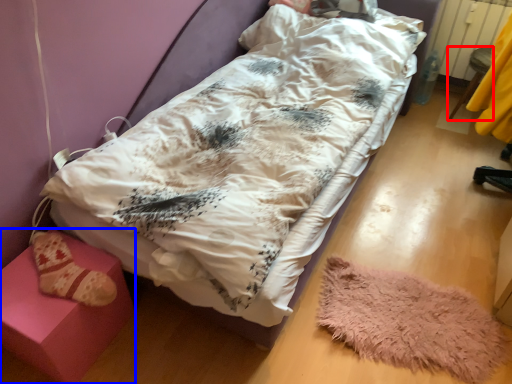
Question: Which object is further to the camera taking this photo, furniture (highlighted by a red box) or furniture (highlighted by a blue box)?

Choices:
 (A) furniture
 (B) furniture

Answer: (A)